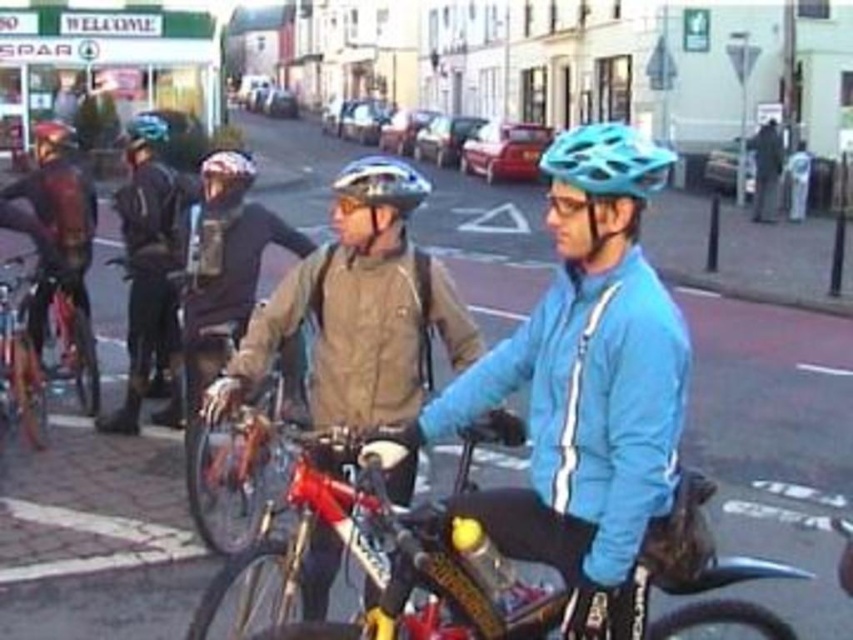
You are a photographer trying to capture a clear shot of the shiny metallic bicycle at left and the matte black helmet at upper left. Which object should you focus on first if you want to ensure both are in sharp focus?

The shiny metallic bicycle at left is positioned under matte black helmet at upper left, so focusing on the shiny metallic bicycle at left first would ensure both are in sharp focus since it is closer to the camera.

You are a cyclist in the group and want to move from the point marked as point (329,624) to the point marked as point (151,294). Can you move directly towards the second point without going around?

Point (329,624) is in front of point (151,294), so you can move directly towards the second point without going around.

You are a photographer setting up for a cycling event. You need to position a camera on a tripod so that both the shiny metallic bicycle at left and the matte black helmet at center are in frame. Considering their heights, which object should be placed closer to the camera to ensure both are fully visible?

The shiny metallic bicycle at left is shorter than the matte black helmet at center, so to ensure both are fully visible, the shorter shiny metallic bicycle at left should be placed closer to the camera.